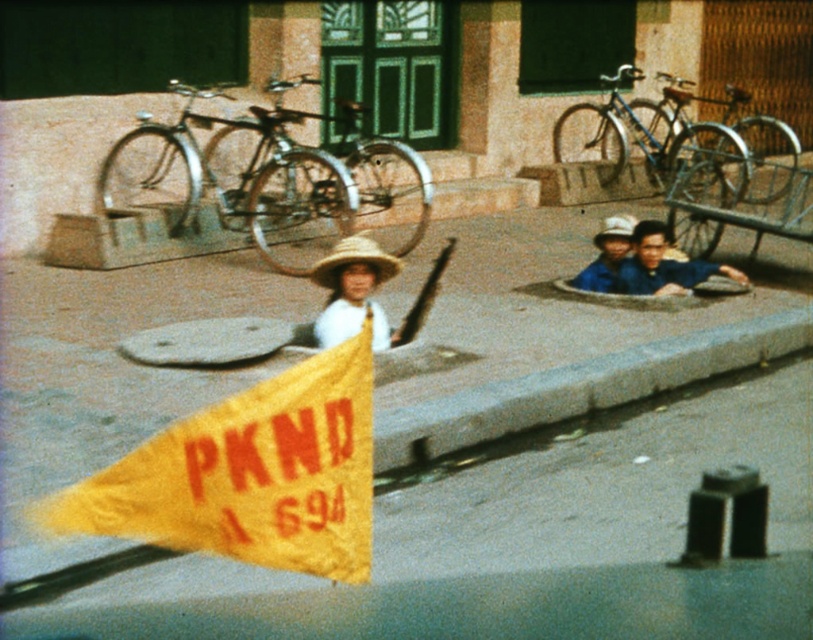
Does yellow fabric flag at center appear under white matte cowboy hat at center?

Yes.

How much distance is there between yellow fabric flag at center and white matte cowboy hat at center?

They are 6.90 meters apart.

Which is in front, point (2, 412) or point (614, 227)?

Point (2, 412) is in front.

This screenshot has height=640, width=813. Find the location of `yellow fabric flag at center`. yellow fabric flag at center is located at coordinates (520, 548).

Between point (364, 316) and point (690, 282), which one is positioned behind?

The point (690, 282) is more distant.

Does matte straw hat at center appear under matte blue shirt at lower right?

Yes.

Is point (346, 330) farther from viewer compared to point (659, 257)?

No, it is in front of (659, 257).

Identify the location of matte straw hat at center. (353, 291).

Is yellow fabric flag at center closer to the viewer compared to gray concrete curb at lower center?

Yes, yellow fabric flag at center is closer to the viewer.

Who is more distant from viewer, (568,620) or (503,428)?

Point (503,428)

In order to click on yellow fabric flag at center in this screenshot , I will do `click(520, 548)`.